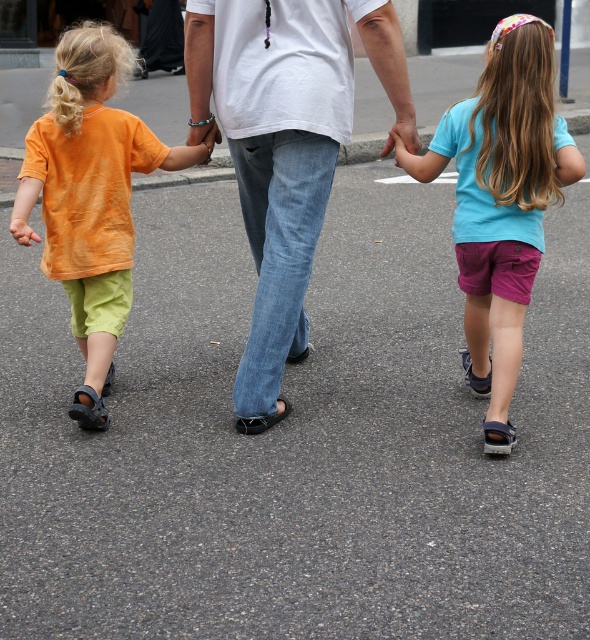
Looking at this image, is matte blue t-shirt at center shorter than matte skin hand at center?

No.

Can you confirm if matte blue t-shirt at center is positioned above matte skin hand at center?

Actually, matte blue t-shirt at center is below matte skin hand at center.

Between point (519, 120) and point (417, 152), which one is positioned behind?

Positioned behind is point (417, 152).

Identify the location of matte blue t-shirt at center. (500, 202).

Does point (59, 150) come in front of point (394, 138)?

No, it is behind (394, 138).

Is point (116, 225) more distant than point (385, 145)?

That is False.

Where is `orange cotton shirt at left`? This screenshot has width=590, height=640. orange cotton shirt at left is located at coordinates (90, 196).

Who is lower down, denim jeans at center or matte blue t-shirt at center?

matte blue t-shirt at center is below.

Who is positioned more to the right, denim jeans at center or matte blue t-shirt at center?

From the viewer's perspective, matte blue t-shirt at center appears more on the right side.

Where is `denim jeans at center`? The width and height of the screenshot is (590, 640). denim jeans at center is located at coordinates (283, 144).

The width and height of the screenshot is (590, 640). Find the location of `denim jeans at center`. denim jeans at center is located at coordinates (283, 144).